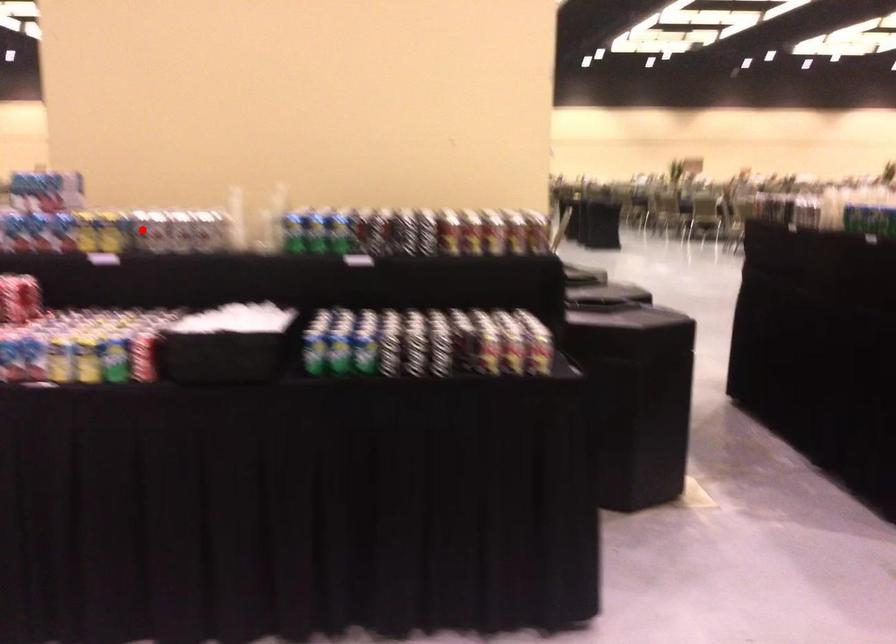
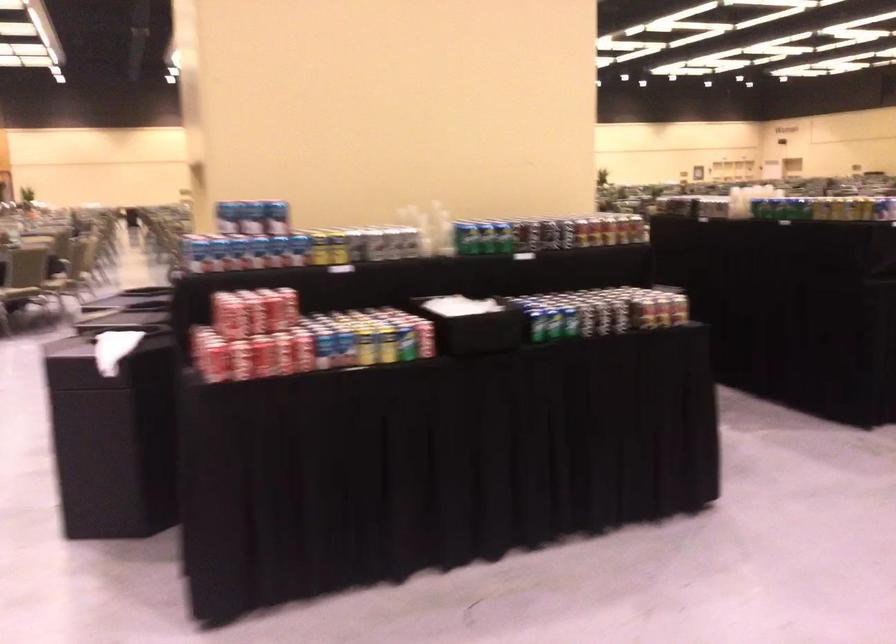
Where in the second image is the point corresponding to the highlighted location from the first image?

(352, 245)